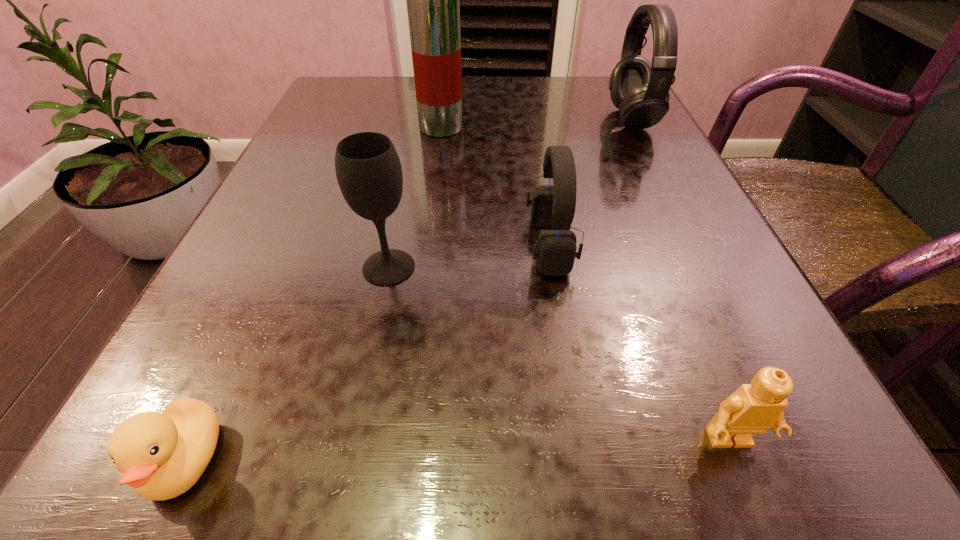
The image size is (960, 540). I want to click on the tallest object, so click(433, 0).

Identify the location of the farther headset. (640, 90).

Where is `the taller headset`? Image resolution: width=960 pixels, height=540 pixels. the taller headset is located at coordinates (640, 90).

Identify the location of wineglass. (368, 169).

You are a GUI agent. You are given a task and a screenshot of the screen. Output one action in this format:
    pyautogui.click(x=<x>, y=<y>)
    Task: Click on the third object from right to left
    Image resolution: width=960 pixels, height=540 pixels.
    Given the screenshot: What is the action you would take?
    pyautogui.click(x=553, y=206)

Identify the location of the nearer headset. (553, 206).

Image resolution: width=960 pixels, height=540 pixels. What are the coordinates of `the fifth tallest object` in the screenshot? It's located at (753, 408).

Locate an element on the screen. This screenshot has height=540, width=960. the leftmost object is located at coordinates (162, 455).

Locate an element on the screen. the shortest object is located at coordinates (162, 455).

Where is `vacant point located 0.050m on the back of the liquor`? The width and height of the screenshot is (960, 540). vacant point located 0.050m on the back of the liquor is located at coordinates [444, 106].